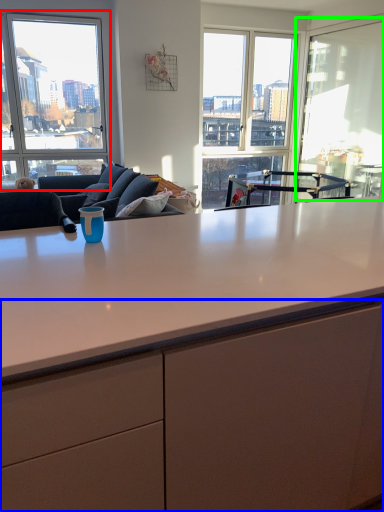
Question: Which is farther away from window (highlighted by a red box)? cabinetry (highlighted by a blue box) or window screen (highlighted by a green box)?

Choices:
 (A) cabinetry
 (B) window screen

Answer: (A)